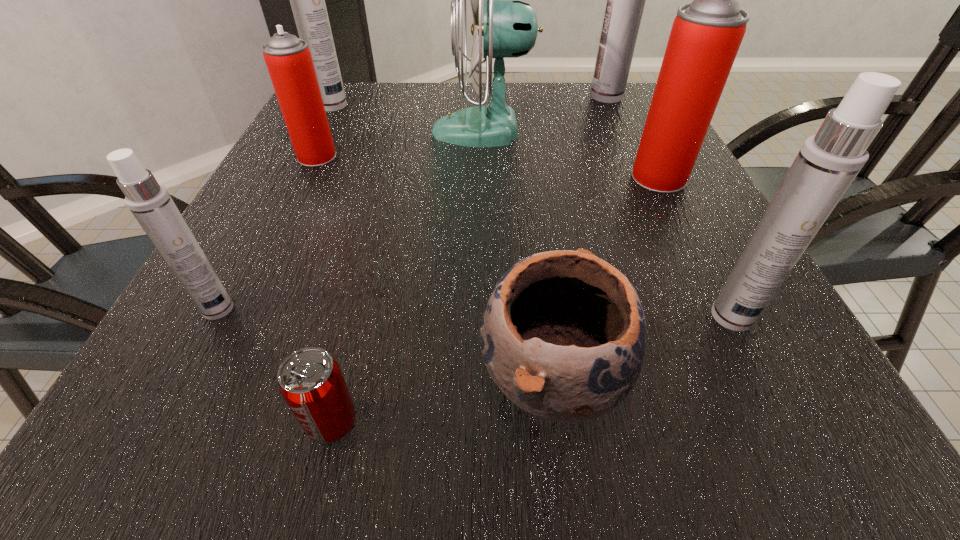
At what (x,y) coordinates should I click in order to perform the action: click on vacant position at the right edge of the desktop. Please return your answer as a coordinate pair (x, y). Image resolution: width=960 pixels, height=540 pixels. Looking at the image, I should click on (735, 348).

Locate an element on the screen. free space at the far left corner is located at coordinates (350, 111).

Locate an element on the screen. The width and height of the screenshot is (960, 540). vacant space that's between the third biggest white aerosol can and the smallest white aerosol can is located at coordinates (475, 313).

This screenshot has width=960, height=540. Find the location of `free point between the right red aerosol can and the third biggest white aerosol can`. free point between the right red aerosol can and the third biggest white aerosol can is located at coordinates (695, 247).

Identify the location of free point between the fan and the second tallest aerosol can. The width and height of the screenshot is (960, 540). (408, 119).

This screenshot has width=960, height=540. Find the location of `free space that is in between the fan and the third biggest white aerosol can`. free space that is in between the fan and the third biggest white aerosol can is located at coordinates (608, 224).

I want to click on vacant area that lies between the left red aerosol can and the third biggest white aerosol can, so click(524, 237).

Find the location of a particular element. The image size is (960, 540). free space between the second shortest object and the smallest white aerosol can is located at coordinates (385, 343).

Find the location of a particular element. This screenshot has height=540, width=960. vacant space that is in between the smallest white aerosol can and the teal fan is located at coordinates (350, 220).

Image resolution: width=960 pixels, height=540 pixels. I want to click on free space that is in between the tallest aerosol can and the right red aerosol can, so click(x=633, y=137).